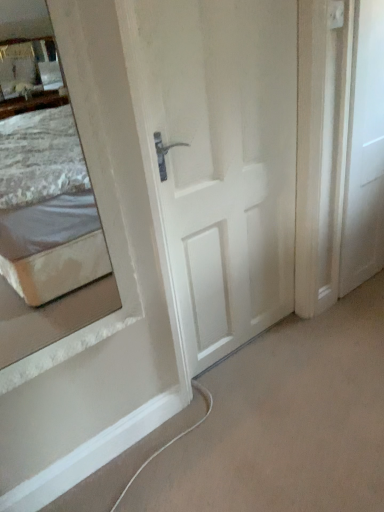
Question: Would you consider white matte door at right, the second door from the left, to be distant from white matte door at center, the 1th door positioned from the left?

Choices:
 (A) yes
 (B) no

Answer: (B)

Question: Is white matte door at right, the second door from the left, at the right side of white matte door at center, the 1th door positioned from the left?

Choices:
 (A) no
 (B) yes

Answer: (B)

Question: From a real-world perspective, is white matte door at right, which is counted as the 1th door, starting from the right, located higher than white matte door at center, the second door when ordered from right to left?

Choices:
 (A) no
 (B) yes

Answer: (A)

Question: Would you say white matte door at right, which is counted as the 1th door, starting from the right, is outside white matte door at center, the second door when ordered from right to left?

Choices:
 (A) no
 (B) yes

Answer: (B)

Question: Is the depth of white matte door at right, the second door from the left, less than that of white matte door at center, the 1th door positioned from the left?

Choices:
 (A) no
 (B) yes

Answer: (A)

Question: Can you confirm if white matte door at right, which is counted as the 1th door, starting from the right, is wider than white matte door at center, the second door when ordered from right to left?

Choices:
 (A) yes
 (B) no

Answer: (B)

Question: Can you confirm if white matte door at center, the second door when ordered from right to left, is wider than white matte door at right, the second door from the left?

Choices:
 (A) no
 (B) yes

Answer: (B)

Question: Is white matte door at center, the 1th door positioned from the left, with white matte door at right, which is counted as the 1th door, starting from the right?

Choices:
 (A) yes
 (B) no

Answer: (B)

Question: Is white matte door at center, the 1th door positioned from the left, taller than white matte door at right, which is counted as the 1th door, starting from the right?

Choices:
 (A) yes
 (B) no

Answer: (A)

Question: Is white matte door at center, the second door when ordered from right to left, at the left side of white matte door at right, the second door from the left?

Choices:
 (A) no
 (B) yes

Answer: (B)

Question: Is white matte door at right, the second door from the left, at the back of white matte door at center, the second door when ordered from right to left?

Choices:
 (A) no
 (B) yes

Answer: (A)

Question: From the image's perspective, is white matte door at center, the second door when ordered from right to left, above white matte door at right, the second door from the left?

Choices:
 (A) no
 (B) yes

Answer: (A)

Question: Is white matte door at right, the second door from the left, taller or shorter than white matte door at center, the second door when ordered from right to left?

Choices:
 (A) tall
 (B) short

Answer: (B)